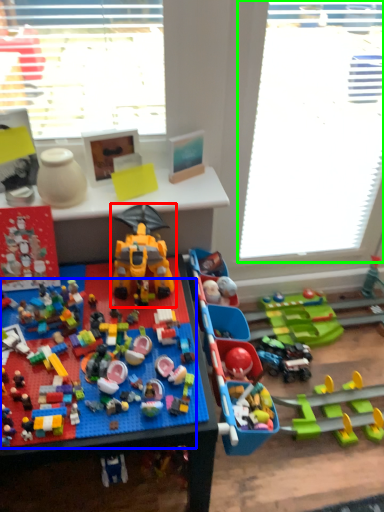
Question: Considering the real-world distances, which object is farthest from toy (highlighted by a red box)? toy (highlighted by a blue box) or window screen (highlighted by a green box)?

Choices:
 (A) toy
 (B) window screen

Answer: (B)